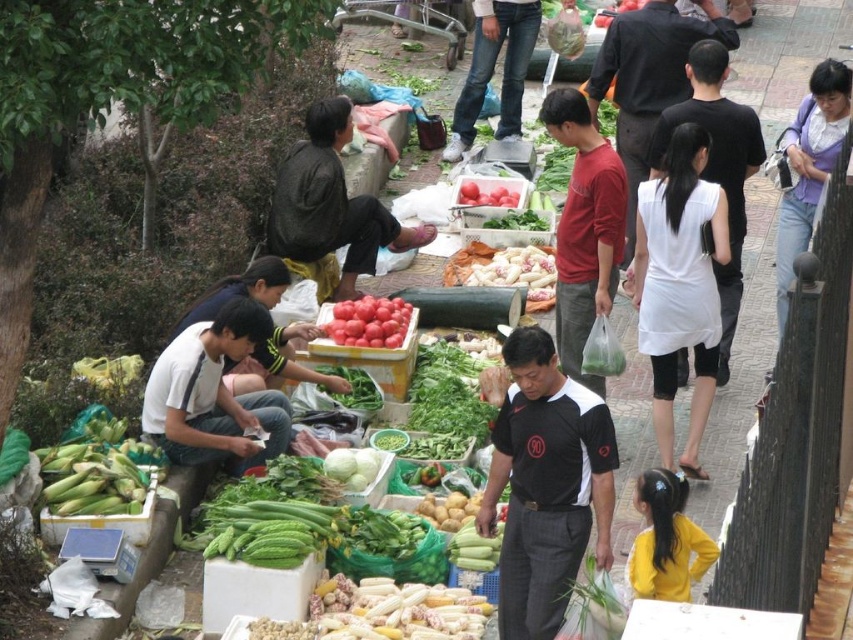
How much distance is there between white cotton dress at center and red matte tomatoes at center?

They are 2.83 meters apart.

Is point (670, 161) positioned after point (368, 296)?

No, it is not.

Where is `white cotton dress at center`? The height and width of the screenshot is (640, 853). white cotton dress at center is located at coordinates (679, 285).

Who is positioned more to the right, black jersey at center or smooth red tomatoes at center?

Positioned to the right is black jersey at center.

Which is behind, point (509, 346) or point (490, 204)?

The point (490, 204) is more distant.

Is point (605, 468) farther from camera compared to point (459, 202)?

No, (605, 468) is in front of (459, 202).

At what (x,y) coordinates should I click in order to perform the action: click on black jersey at center. Please return your answer as a coordinate pair (x, y). The height and width of the screenshot is (640, 853). Looking at the image, I should click on click(544, 484).

Can you confirm if white cotton dress at center is thinner than smooth red tomatoes at center?

Indeed, white cotton dress at center has a lesser width compared to smooth red tomatoes at center.

Is point (727, 250) less distant than point (498, 202)?

That is True.

Which is in front, point (662, 364) or point (486, 202)?

Positioned in front is point (662, 364).

Where is `white cotton dress at center`? white cotton dress at center is located at coordinates (679, 285).